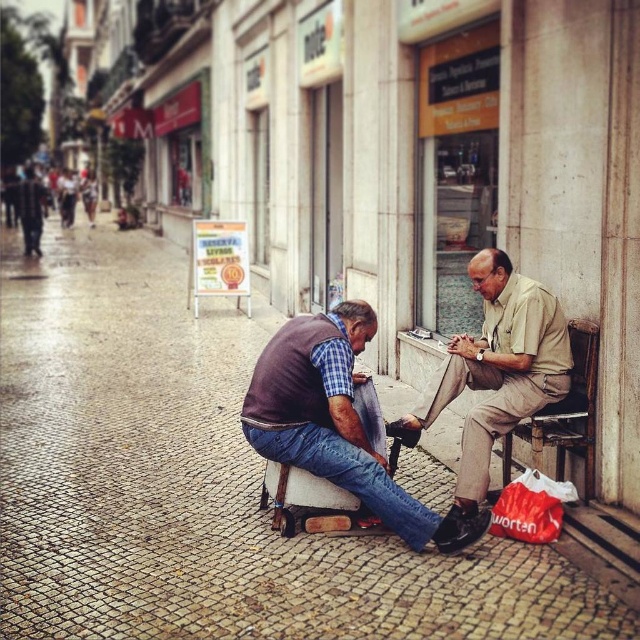
Question: Is cobblestone pavement at center wider than brown leather shoe at lower center?

Choices:
 (A) yes
 (B) no

Answer: (A)

Question: Is cobblestone pavement at center thinner than brown leather shoe at lower center?

Choices:
 (A) yes
 (B) no

Answer: (B)

Question: Which of the following is the closest to the observer?

Choices:
 (A) brown leather shoe at lower center
 (B) cobblestone pavement at center
 (C) beige cotton shirt at center

Answer: (B)

Question: Among these objects, which one is farthest from the camera?

Choices:
 (A) beige cotton shirt at center
 (B) cobblestone pavement at center

Answer: (A)

Question: Among these points, which one is nearest to the camera?

Choices:
 (A) [378, 436]
 (B) [522, 406]

Answer: (B)

Question: Is cobblestone pavement at center above beige cotton shirt at center?

Choices:
 (A) yes
 (B) no

Answer: (A)